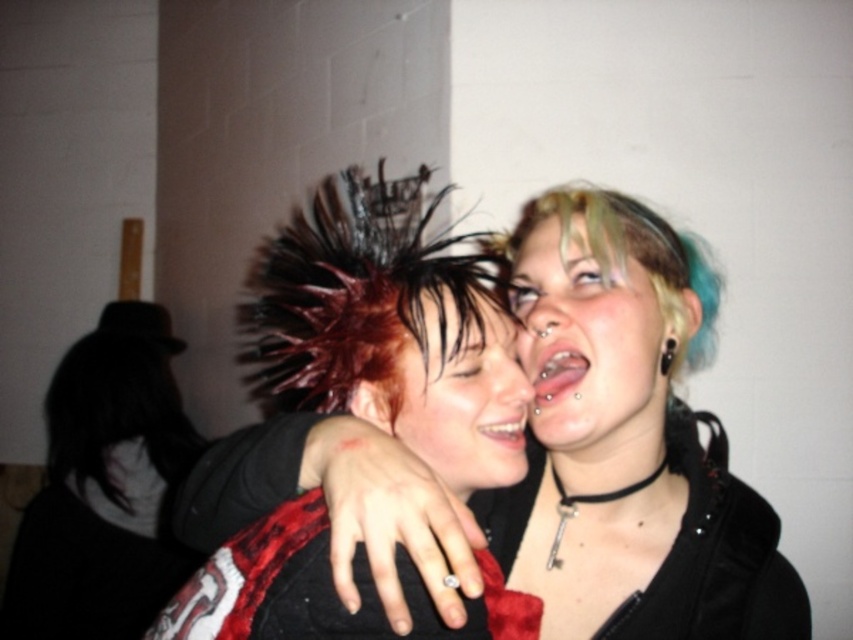
Who is more forward, (x=682, y=624) or (x=157, y=413)?

Positioned in front is point (x=682, y=624).

This screenshot has width=853, height=640. What do you see at coordinates (627, 444) in the screenshot? I see `matte black jacket at center` at bounding box center [627, 444].

Describe the element at coordinates (627, 444) in the screenshot. I see `matte black jacket at center` at that location.

The height and width of the screenshot is (640, 853). Identify the location of matte black jacket at center. (627, 444).

Does matte black jacket at center have a greater height compared to velvet red dress at center?

Indeed, matte black jacket at center has a greater height compared to velvet red dress at center.

Can you confirm if matte black jacket at center is positioned to the right of velvet red dress at center?

Yes, matte black jacket at center is to the right of velvet red dress at center.

What do you see at coordinates (627, 444) in the screenshot? I see `matte black jacket at center` at bounding box center [627, 444].

This screenshot has height=640, width=853. Identify the location of matte black jacket at center. (627, 444).

Who is lower down, shiny red hair at center or velvet red dress at center?

velvet red dress at center is lower down.

Does point (453, 420) come behind point (486, 563)?

Yes, it is behind point (486, 563).

Describe the element at coordinates (465, 401) in the screenshot. The width and height of the screenshot is (853, 640). I see `shiny red hair at center` at that location.

Locate an element on the screen. The width and height of the screenshot is (853, 640). shiny red hair at center is located at coordinates (465, 401).